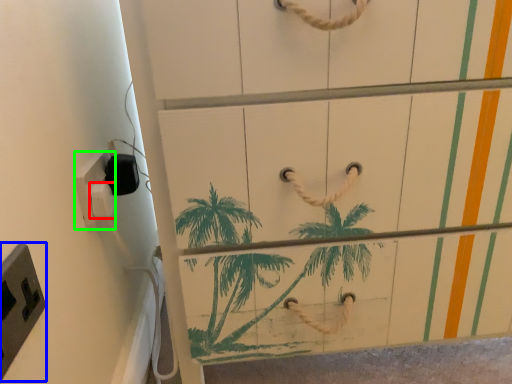
Question: Considering the real-world distances, which object is farthest from light switch (highlighted by a red box)? light switch (highlighted by a blue box) or light switch (highlighted by a green box)?

Choices:
 (A) light switch
 (B) light switch

Answer: (A)